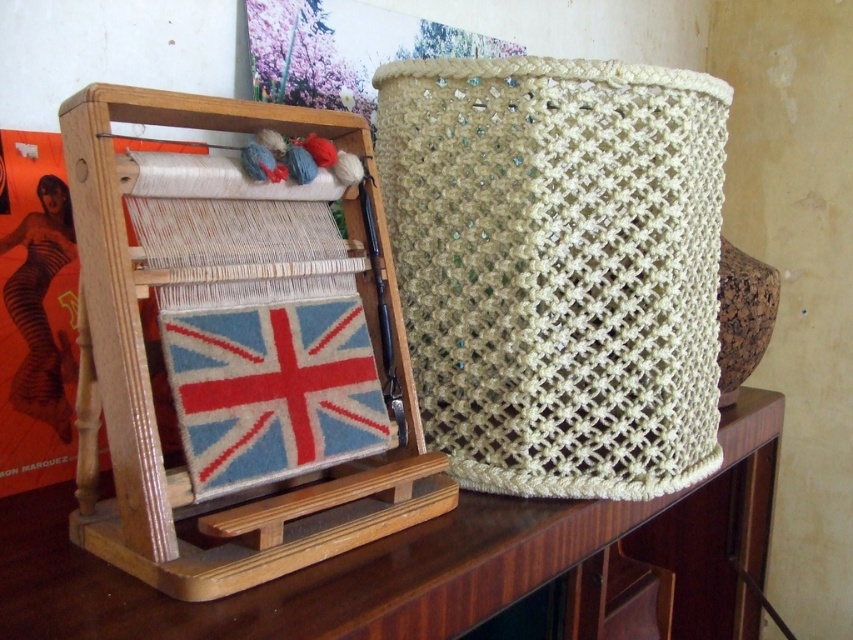
Question: Is beige woven basket at center to the left of woolen union jack at center from the viewer's perspective?

Choices:
 (A) yes
 (B) no

Answer: (B)

Question: Can you confirm if beige woven basket at center is positioned to the left of woolen union jack at center?

Choices:
 (A) no
 (B) yes

Answer: (A)

Question: Among these points, which one is nearest to the camera?

Choices:
 (A) (351, 376)
 (B) (614, 380)

Answer: (A)

Question: Which object is the farthest from the woolen union jack at center?

Choices:
 (A) beige woven basket at center
 (B) wooden table at center

Answer: (A)

Question: Is the position of beige woven basket at center more distant than that of woolen union jack at center?

Choices:
 (A) no
 (B) yes

Answer: (B)

Question: Estimate the real-world distances between objects in this image. Which object is farther from the beige woven basket at center?

Choices:
 (A) woolen union jack at center
 (B) wooden table at center

Answer: (A)